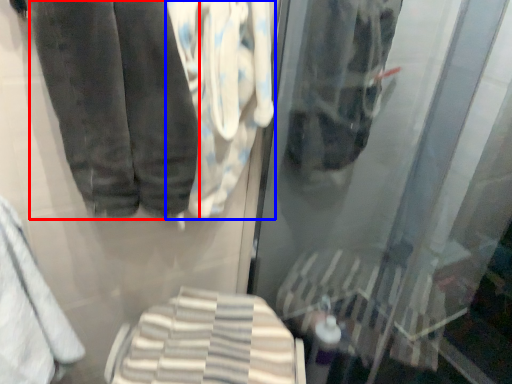
Question: Which point is closer to the camera, trousers (highlighted by a red box) or cloth (highlighted by a blue box)?

Choices:
 (A) trousers
 (B) cloth

Answer: (A)